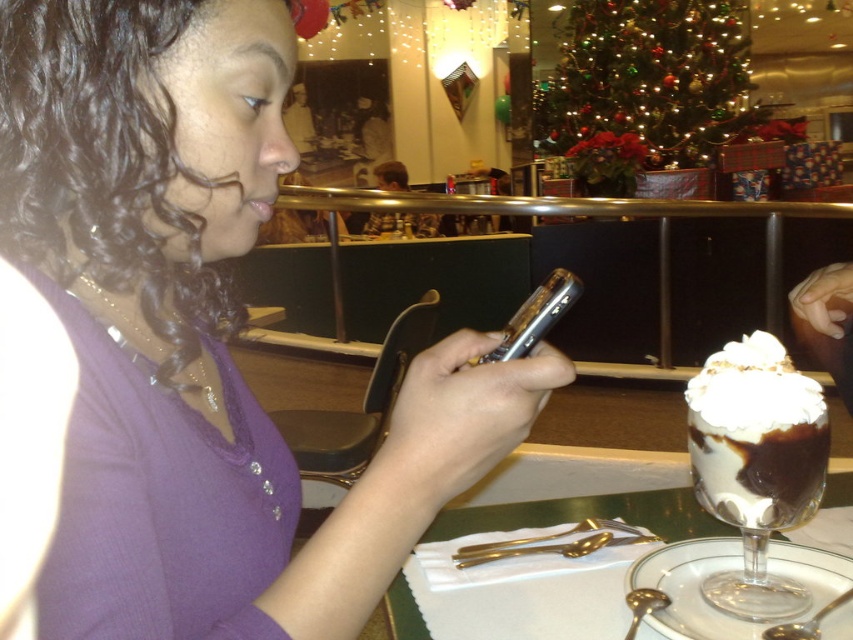
You are a waiter in a festive restaurant. You need to place a new dessert menu on the table between the clear glass dessert at lower right and the silver metallic phone at center. Where should you place it so it doesn

The clear glass dessert at lower right is to the right of the silver metallic phone at center. Therefore, the dessert menu should be placed between them, closer to the silver metallic phone at center to avoid blocking the dessert.

You are a waiter in this festive restaurant. You need to place a new order of drinks on the table without disturbing the silver metallic phone at center. Considering the clear glass dessert at lower right is shorter than the phone, where should you place the drinks?

Since the clear glass dessert at lower right has a lesser height than the silver metallic phone at center, you should place the drinks near the dessert to avoid blocking the phone which is taller and might be in the way.

You are a photographer standing in front of the purple matte shirt at center. You want to take a closeup photo of the shirt without any distortion. What is the minimum distance you should maintain from the shirt to avoid distortion?

The minimum distance you should maintain from the purple matte shirt at center to avoid distortion is 12.93 inches, as this is the closest point where the shirt remains in focus without distortion.